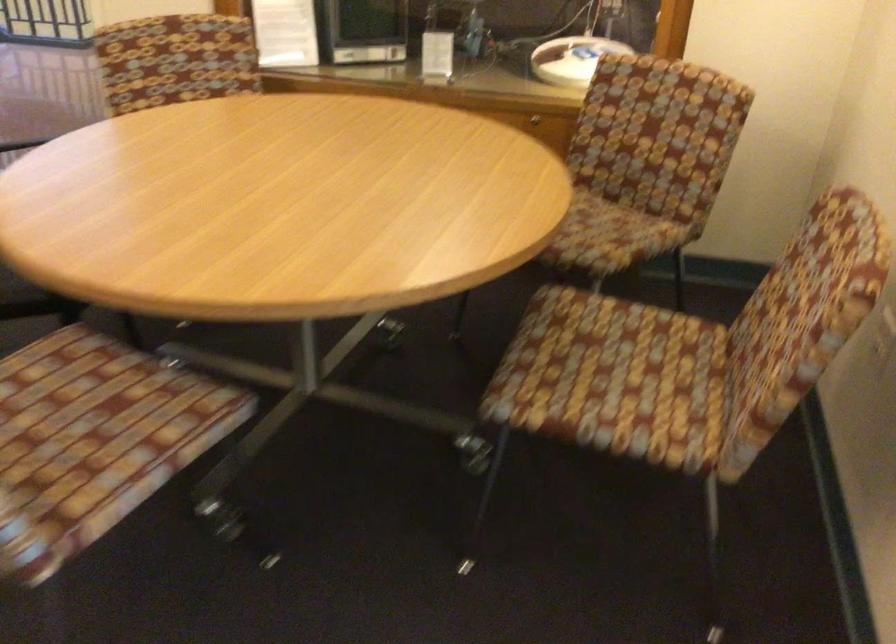
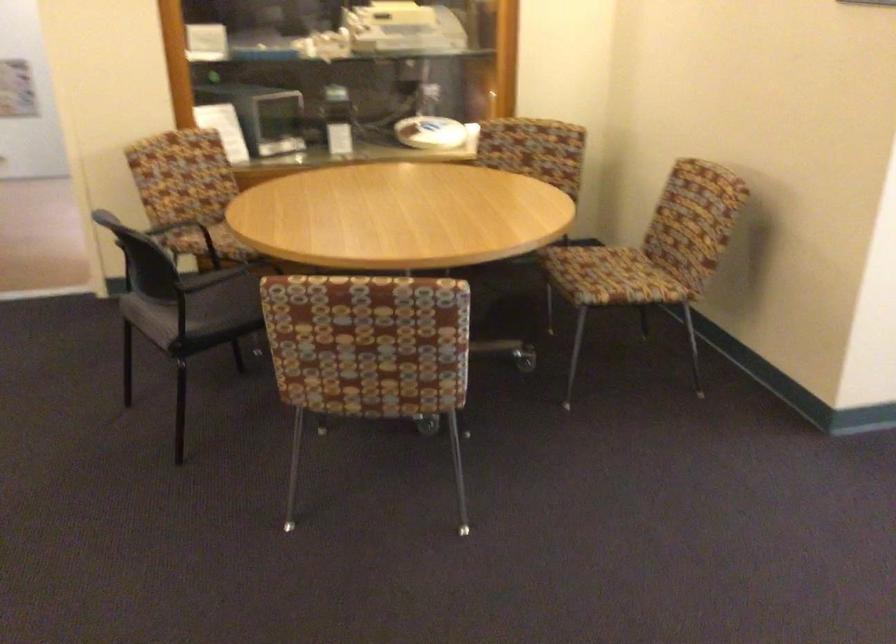
In the second image, find the point that corresponds to [721,366] in the first image.

(652, 254)